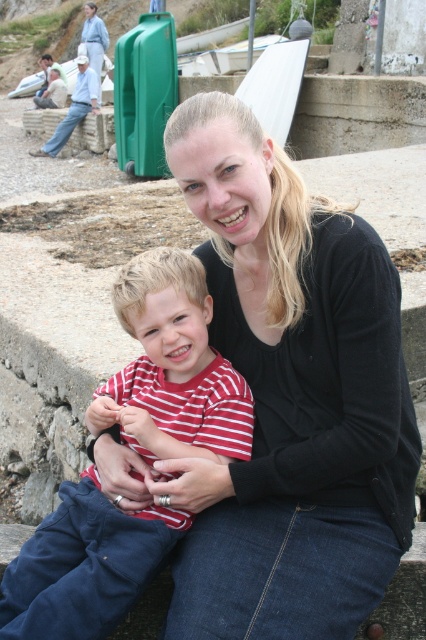
Question: Can you confirm if black matte sweater at center is positioned above striped fabric shirt at center?

Choices:
 (A) yes
 (B) no

Answer: (A)

Question: From the image, what is the correct spatial relationship of black matte sweater at center in relation to striped fabric shirt at center?

Choices:
 (A) below
 (B) above

Answer: (B)

Question: Which point appears farthest from the camera in this image?

Choices:
 (A) (178, 561)
 (B) (190, 268)

Answer: (B)

Question: Which point is farther from the camera taking this photo?

Choices:
 (A) (193, 419)
 (B) (402, 461)

Answer: (A)

Question: Is black matte sweater at center below striped fabric shirt at center?

Choices:
 (A) no
 (B) yes

Answer: (A)